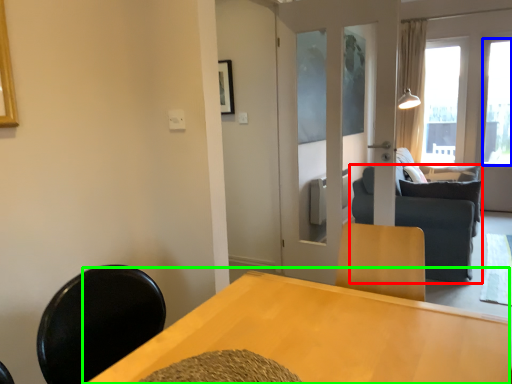
Question: Which object is the closest to the studio couch (highlighted by a red box)? Choose among these: window (highlighted by a blue box) or table (highlighted by a green box).

Choices:
 (A) window
 (B) table

Answer: (B)